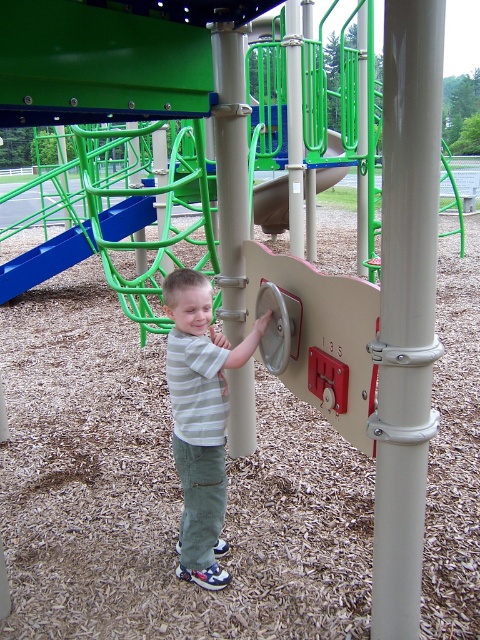
You are standing at the playground and want to place a new bench between the two points, point (420, 65) and point (197, 385). Which point should the bench be closer to if you want it to be nearer to the slide?

The bench should be placed closer to point (197, 385) because it is farther from the viewer, and the slide is likely located in the background. Since point (420, 65) is closer to the viewer, placing the bench near point (197, 385) would position it nearer to the slide in the background.

You are a parent trying to take a photo of your child playing. You notice the striped cotton shirt at center and the smooth beige pole at center in the background. To ensure the shirt is visible clearly in the photo, should you adjust your camera angle so the shirt is closer to the front or the back compared to the pole?

The striped cotton shirt at center might be wider than smooth beige pole at center, so to ensure the shirt is visible clearly, you should position it closer to the front of the photo compared to the pole to avoid it being obscured.

You are a parent supervising children at the playground. You need to ensure that all equipment is within a safe height limit of 1.5 meters. The smooth beige pole at center and the green plastic slide at upper center are two pieces of equipment. Based on their heights, which one might exceed the safety limit?

The green plastic slide at upper center is taller than the smooth beige pole at center, so it might exceed the 1.5 meter safety limit.